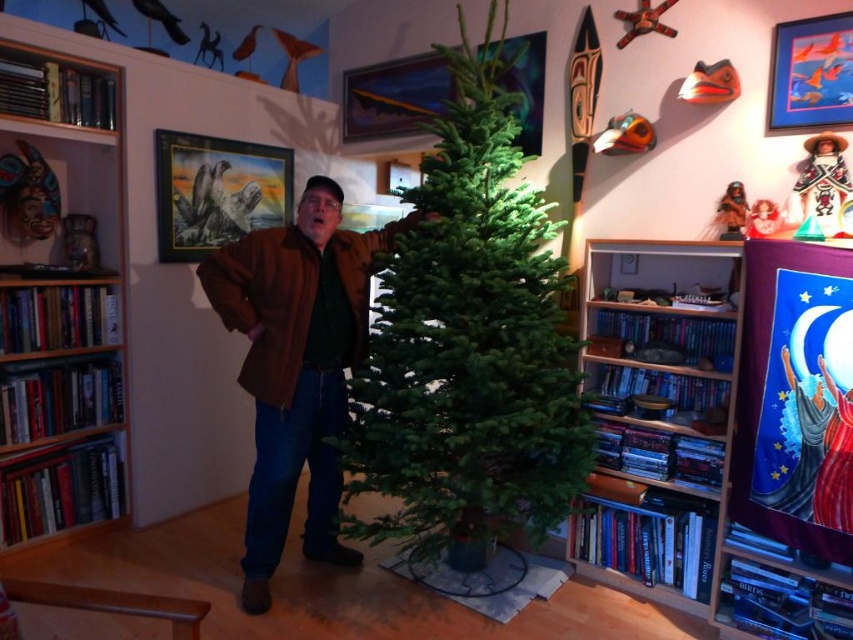
Question: Which object is the closest to the green matte christmas tree at center?

Choices:
 (A) brown leather jacket at center
 (B) wooden bookshelf at left

Answer: (A)

Question: Does green matte christmas tree at center appear under wooden bookshelf at left?

Choices:
 (A) no
 (B) yes

Answer: (A)

Question: Can you confirm if wooden bookshelf at left is positioned to the right of wooden bookshelf at right?

Choices:
 (A) yes
 (B) no

Answer: (B)

Question: Based on their relative distances, which object is nearer to the brown leather jacket at center?

Choices:
 (A) wooden bookshelf at left
 (B) wooden bookshelf at right

Answer: (A)

Question: Can you confirm if wooden bookshelf at left is positioned to the right of wooden bookshelf at right?

Choices:
 (A) yes
 (B) no

Answer: (B)

Question: Considering the real-world distances, which object is farthest from the green matte christmas tree at center?

Choices:
 (A) wooden bookshelf at right
 (B) brown leather jacket at center

Answer: (A)